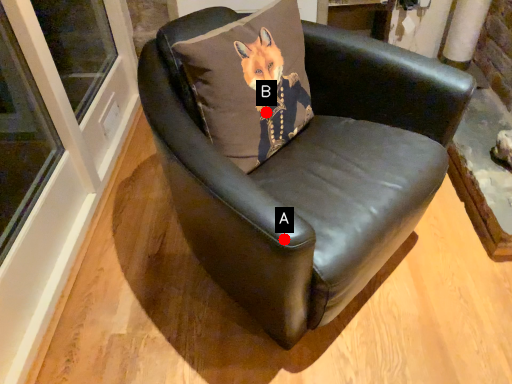
Question: Two points are circled on the image, labeled by A and B beside each circle. Which of the following is the farthest from the observer?

Choices:
 (A) A is further
 (B) B is further

Answer: (B)